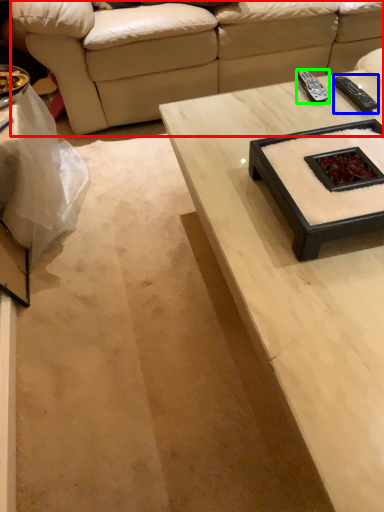
Question: Which object is positioned closest to studio couch (highlighted by a red box)? Select from remote (highlighted by a blue box) and remote (highlighted by a green box).

Choices:
 (A) remote
 (B) remote

Answer: (B)